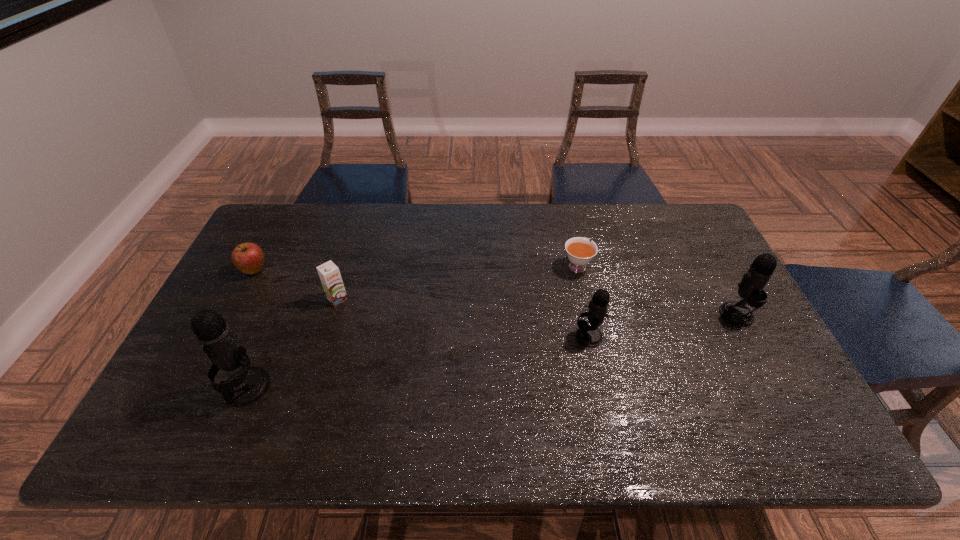
I want to click on the nearest microphone, so coord(247,385).

Find the location of a particular element. This screenshot has height=540, width=960. the tallest object is located at coordinates (247, 385).

Locate an element on the screen. This screenshot has width=960, height=540. the second microphone from right to left is located at coordinates (588, 335).

Identify the location of the shortest microphone. Image resolution: width=960 pixels, height=540 pixels. (588, 335).

Where is `the rightmost microphone`? The width and height of the screenshot is (960, 540). the rightmost microphone is located at coordinates (751, 287).

Where is `the fifth shortest object`? This screenshot has height=540, width=960. the fifth shortest object is located at coordinates (751, 287).

At what (x,y) coordinates should I click in order to perform the action: click on the fourth tallest object. Please return your answer as a coordinate pair (x, y). The height and width of the screenshot is (540, 960). Looking at the image, I should click on (329, 273).

Identify the location of the fourth object from right to left. (329, 273).

Image resolution: width=960 pixels, height=540 pixels. I want to click on the shortest object, so click(x=580, y=252).

Where is `apple`? Image resolution: width=960 pixels, height=540 pixels. apple is located at coordinates (248, 257).